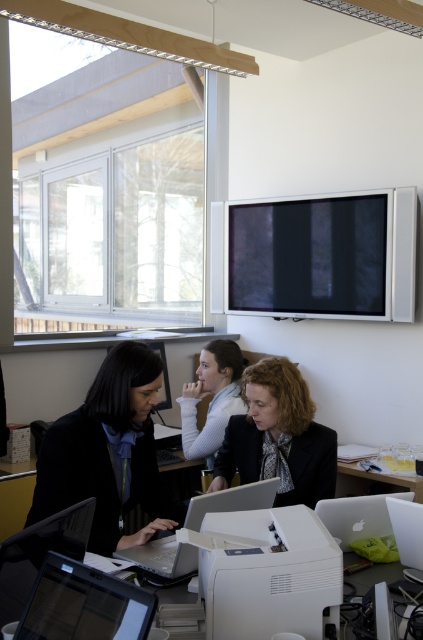
You are organizing a meeting in the office and need to place a large presentation screen between the white plastic table at lower center and the white plastic table at lower right. Based on their sizes, which table should the screen be placed closer to?

The white plastic table at lower right is larger, so the screen should be placed closer to it to accommodate its size.

You are standing in the office and see the point at coordinates (279,436). Which object is this point located on?

The point at coordinates (279,436) is located on the matte black jacket at center.